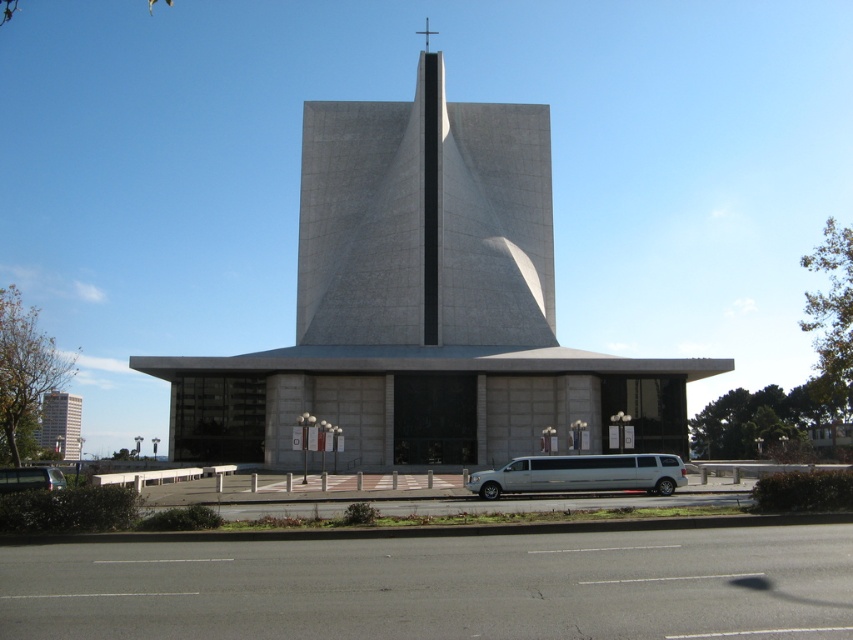
Question: Which of the following is the farthest from the observer?

Choices:
 (A) (550, 480)
 (B) (20, 486)

Answer: (A)

Question: Which object is the farthest from the silver metallic limousine at lower center?

Choices:
 (A) smooth concrete church at center
 (B) metallic silver van at lower left

Answer: (A)

Question: Which of the following is the farthest from the observer?

Choices:
 (A) (64, 417)
 (B) (669, 472)
 (C) (25, 472)
 (D) (323, 388)

Answer: (A)

Question: Can you confirm if silver metallic limousine at lower center is smaller than metallic silver van at lower left?

Choices:
 (A) no
 (B) yes

Answer: (A)

Question: Does smooth concrete church at center have a lesser width compared to metallic silver van at lower left?

Choices:
 (A) no
 (B) yes

Answer: (A)

Question: Is smooth concrete church at center thinner than metallic silver van at lower left?

Choices:
 (A) no
 (B) yes

Answer: (A)